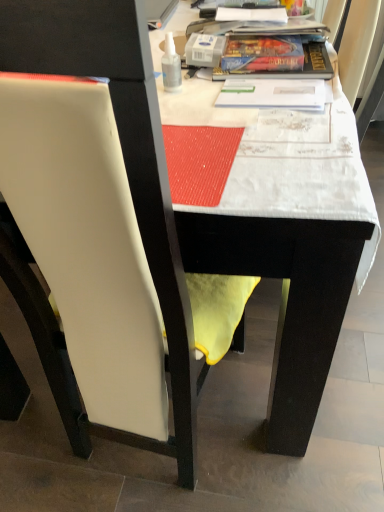
This screenshot has width=384, height=512. What do you see at coordinates (87, 245) in the screenshot? I see `white leather chair at left` at bounding box center [87, 245].

What are the coordinates of `white leather chair at left` in the screenshot? It's located at click(87, 245).

Locate an element on the screen. The width and height of the screenshot is (384, 512). transparent plastic bottle at upper center is located at coordinates (171, 66).

Find the location of `white fabric table at upper center`. white fabric table at upper center is located at coordinates (294, 253).

Considering the positions of objects white leather chair at left and transparent plastic bottle at upper center in the image provided, who is behind, white leather chair at left or transparent plastic bottle at upper center?

transparent plastic bottle at upper center.

From the image's perspective, which one is positioned higher, white leather chair at left or transparent plastic bottle at upper center?

From the image's view, transparent plastic bottle at upper center is above.

Could you tell me if white leather chair at left is turned towards transparent plastic bottle at upper center?

No.

Would you say white leather chair at left is inside or outside transparent plastic bottle at upper center?

white leather chair at left is not enclosed by transparent plastic bottle at upper center.

Is transparent plastic bottle at upper center positioned beyond the bounds of white leather chair at left?

Absolutely, transparent plastic bottle at upper center is external to white leather chair at left.

From a real-world perspective, is transparent plastic bottle at upper center physically located above or below white leather chair at left?

Clearly, from a real-world perspective, transparent plastic bottle at upper center is above white leather chair at left.

Is transparent plastic bottle at upper center in front of white leather chair at left?

No.

Based on their positions, is transparent plastic bottle at upper center located to the left or right of white leather chair at left?

transparent plastic bottle at upper center is to the right of white leather chair at left.

From a real-world perspective, which is physically below, transparent plastic bottle at upper center or white fabric table at upper center?

In real-world perspective, white fabric table at upper center is lower.

Is there a large distance between transparent plastic bottle at upper center and white fabric table at upper center?

No, transparent plastic bottle at upper center is not far from white fabric table at upper center.

Relative to white fabric table at upper center, is transparent plastic bottle at upper center in front or behind?

transparent plastic bottle at upper center is positioned farther from the viewer than white fabric table at upper center.

Considering the relative sizes of transparent plastic bottle at upper center and white fabric table at upper center in the image provided, is transparent plastic bottle at upper center wider than white fabric table at upper center?

Incorrect, the width of transparent plastic bottle at upper center does not surpass that of white fabric table at upper center.

In terms of size, does white fabric table at upper center appear bigger or smaller than white leather chair at left?

Clearly, white fabric table at upper center is smaller in size than white leather chair at left.

Which object is closer to the camera, white fabric table at upper center or white leather chair at left?

white leather chair at left is in front.

Could you tell me if white fabric table at upper center is turned towards white leather chair at left?

No, white fabric table at upper center is not oriented towards white leather chair at left.

Which is farther, (314, 396) or (175, 356)?

Point (314, 396)

Would you say white leather chair at left is a long distance from white fabric table at upper center?

white leather chair at left is actually quite close to white fabric table at upper center.

Is white leather chair at left in front of white fabric table at upper center?

Yes, the depth of white leather chair at left is less than that of white fabric table at upper center.

You are a GUI agent. You are given a task and a screenshot of the screen. Output one action in this format:
    pyautogui.click(x=<x>, y=<y>)
    Task: Click on the chair above the white fabric table at upper center (from a real-world perspective)
    Image resolution: width=384 pixels, height=512 pixels.
    Given the screenshot: What is the action you would take?
    pyautogui.click(x=87, y=245)

From a real-world perspective, which is physically below, white leather chair at left or white fabric table at upper center?

From a 3D spatial view, white fabric table at upper center is below.

Who is bigger, white fabric table at upper center or transparent plastic bottle at upper center?

white fabric table at upper center is bigger.

Does point (262, 229) lie in front of point (181, 78)?

Yes, it is in front of point (181, 78).

Is white fabric table at upper center surrounding transparent plastic bottle at upper center?

Indeed, transparent plastic bottle at upper center is located within white fabric table at upper center.

Is white fabric table at upper center facing away from transparent plastic bottle at upper center?

No, transparent plastic bottle at upper center is not at the back of white fabric table at upper center.

This screenshot has height=512, width=384. I want to click on bottle lying on the right of white leather chair at left, so click(x=171, y=66).

This screenshot has height=512, width=384. What are the coordinates of `bottle above the white leather chair at left (from a real-world perspective)` in the screenshot? It's located at (171, 66).

Which object lies further to the anchor point white fabric table at upper center, white leather chair at left or transparent plastic bottle at upper center?

Among the two, transparent plastic bottle at upper center is located further to white fabric table at upper center.

From the image, which object appears to be farther from transparent plastic bottle at upper center, white leather chair at left or white fabric table at upper center?

white leather chair at left lies further to transparent plastic bottle at upper center than the other object.

Based on their spatial positions, is white fabric table at upper center or white leather chair at left further from transparent plastic bottle at upper center?

white leather chair at left.

Which object lies nearer to the anchor point white fabric table at upper center, transparent plastic bottle at upper center or white leather chair at left?

The object closer to white fabric table at upper center is white leather chair at left.

From the picture: Looking at the image, which one is located closer to white leather chair at left, white fabric table at upper center or transparent plastic bottle at upper center?

white fabric table at upper center lies closer to white leather chair at left than the other object.

In the scene shown: Based on their spatial positions, is transparent plastic bottle at upper center or white fabric table at upper center closer to white leather chair at left?

The object closer to white leather chair at left is white fabric table at upper center.

Image resolution: width=384 pixels, height=512 pixels. In order to click on table between white leather chair at left and transparent plastic bottle at upper center in the front-back direction in this screenshot , I will do `click(294, 253)`.